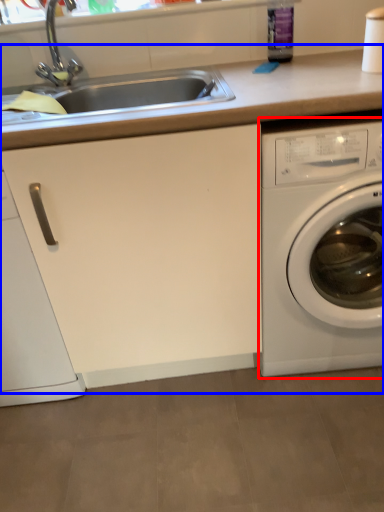
Question: Which object appears closest to the camera in this image, washing machine (highlighted by a red box) or counter top (highlighted by a blue box)?

Choices:
 (A) washing machine
 (B) counter top

Answer: (B)